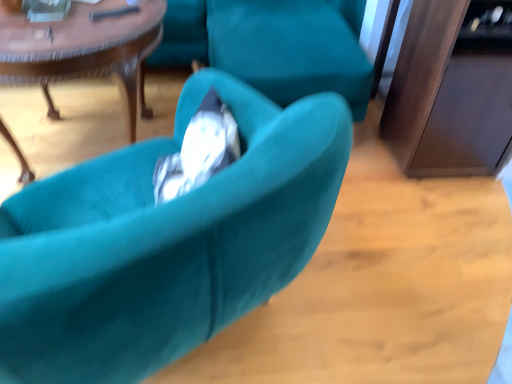
Question: Visually, is wooden polished coffee table at center positioned to the left or to the right of teal velvet chair at center?

Choices:
 (A) right
 (B) left

Answer: (B)

Question: Is wooden polished coffee table at center wider or thinner than teal velvet chair at center?

Choices:
 (A) wide
 (B) thin

Answer: (A)

Question: Relative to teal velvet chair at center, is wooden polished coffee table at center in front or behind?

Choices:
 (A) behind
 (B) front

Answer: (A)

Question: Considering the positions of teal velvet chair at center and wooden polished coffee table at center in the image, is teal velvet chair at center taller or shorter than wooden polished coffee table at center?

Choices:
 (A) tall
 (B) short

Answer: (A)

Question: Relative to wooden polished coffee table at center, is teal velvet chair at center in front or behind?

Choices:
 (A) front
 (B) behind

Answer: (A)

Question: From a real-world perspective, is teal velvet chair at center above or below wooden polished coffee table at center?

Choices:
 (A) below
 (B) above

Answer: (B)

Question: From the image's perspective, relative to wooden polished coffee table at center, is teal velvet chair at center above or below?

Choices:
 (A) above
 (B) below

Answer: (B)